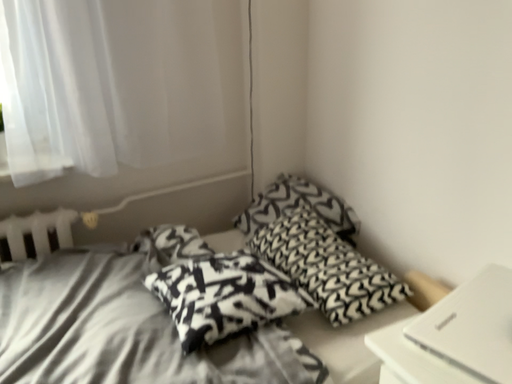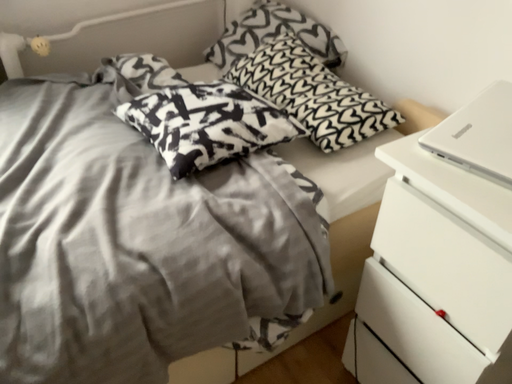
Question: How did the camera likely rotate when shooting the video?

Choices:
 (A) rotated downward
 (B) rotated upward

Answer: (A)